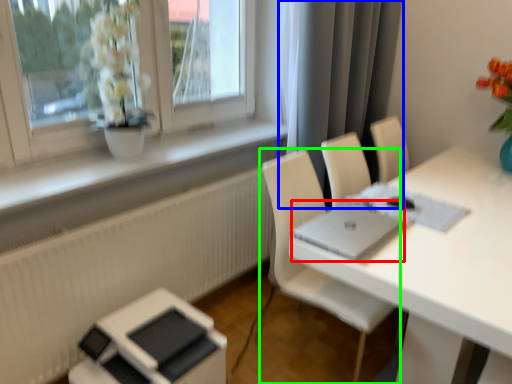
Question: Which object is positioned closest to laptop (highlighted by a red box)? Select from curtain (highlighted by a blue box) and chair (highlighted by a green box).

Choices:
 (A) curtain
 (B) chair

Answer: (B)